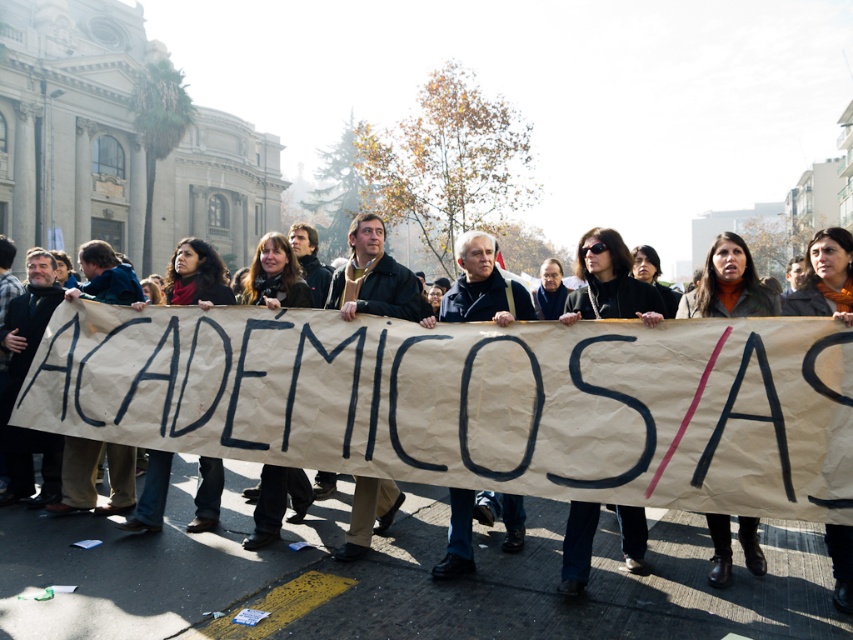
Question: Among these objects, which one is nearest to the camera?

Choices:
 (A) dark brown leather jacket at center
 (B) matte black sunglasses at center
 (C) dark gray sweater at center

Answer: (A)

Question: Which point is farther from the camera taking this photo?

Choices:
 (A) (418, 396)
 (B) (469, 355)
 (C) (601, 296)

Answer: (C)

Question: Which of the following is the closest to the observer?

Choices:
 (A) [x=567, y=493]
 (B) [x=489, y=280]
 (C) [x=572, y=323]

Answer: (A)

Question: Can you confirm if dark brown leather jacket at center is positioned above dark gray sweater at center?

Choices:
 (A) yes
 (B) no

Answer: (B)

Question: Does matte black sunglasses at center appear over dark gray sweater at center?

Choices:
 (A) yes
 (B) no

Answer: (A)

Question: Does dark brown leather jacket at center appear over matte black sunglasses at center?

Choices:
 (A) no
 (B) yes

Answer: (A)